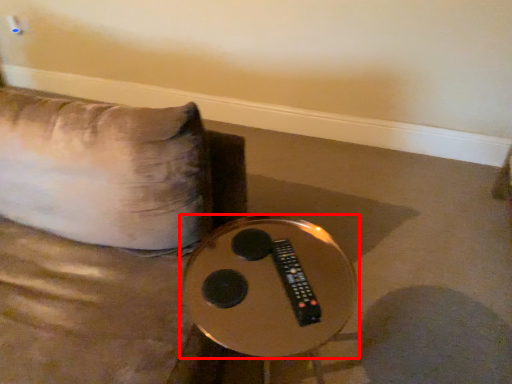
Question: Where is table (annotated by the red box) located in relation to remote in the image?

Choices:
 (A) right
 (B) left

Answer: (B)